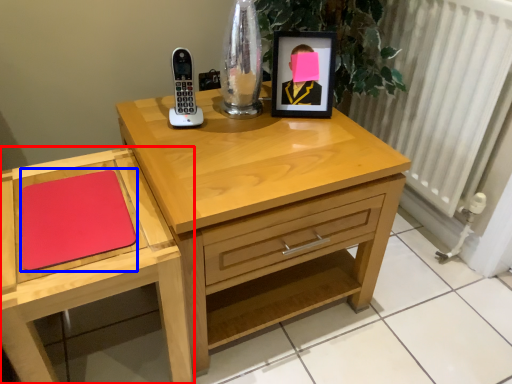
Question: Which of the following is the closest to the observer, chest of drawers (highlighted by a red box) or notepad (highlighted by a blue box)?

Choices:
 (A) chest of drawers
 (B) notepad

Answer: (A)